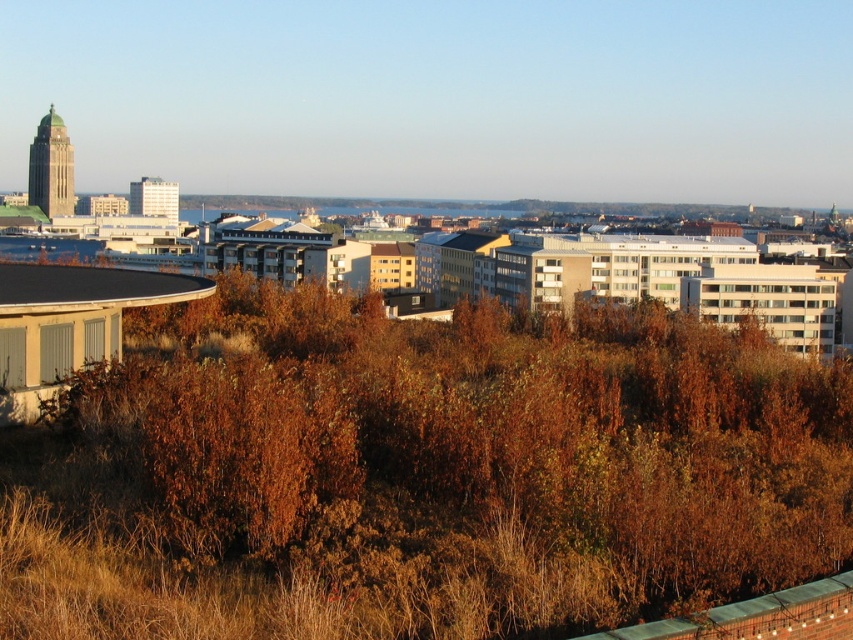
Question: Is brown leafy shrub at left wider than blue glass water at lower left?

Choices:
 (A) no
 (B) yes

Answer: (A)

Question: Which object is closer to the camera taking this photo?

Choices:
 (A) blue glass water at lower left
 (B) brown leafy shrub at left

Answer: (B)

Question: Is brown leafy shrub at left closer to camera compared to blue glass water at lower left?

Choices:
 (A) no
 (B) yes

Answer: (B)

Question: Considering the relative positions of brown leafy shrub at left and blue glass water at lower left in the image provided, where is brown leafy shrub at left located with respect to blue glass water at lower left?

Choices:
 (A) left
 (B) right

Answer: (B)

Question: Which point is closer to the camera?

Choices:
 (A) (415, 611)
 (B) (6, 256)

Answer: (A)